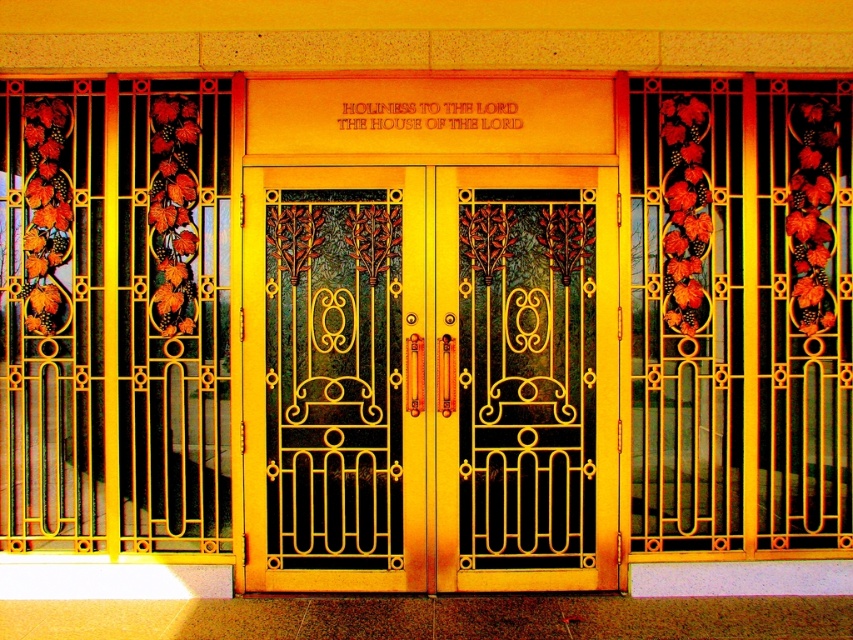
Question: Among these points, which one is nearest to the camera?

Choices:
 (A) (351, 301)
 (B) (265, 428)

Answer: (B)

Question: Can you confirm if gold polished metal doors at center is positioned to the left of gold textured screen door at center?

Choices:
 (A) yes
 (B) no

Answer: (B)

Question: Can you confirm if gold polished metal doors at center is positioned to the left of gold textured door at center?

Choices:
 (A) no
 (B) yes

Answer: (B)

Question: Is gold polished metal doors at center above gold textured door at center?

Choices:
 (A) yes
 (B) no

Answer: (B)

Question: Which of the following is the closest to the observer?

Choices:
 (A) gold textured door at center
 (B) gold textured screen door at center
 (C) gold polished metal doors at center

Answer: (B)

Question: Which object is positioned farthest from the gold polished metal doors at center?

Choices:
 (A) gold textured door at center
 (B) gold textured screen door at center

Answer: (A)